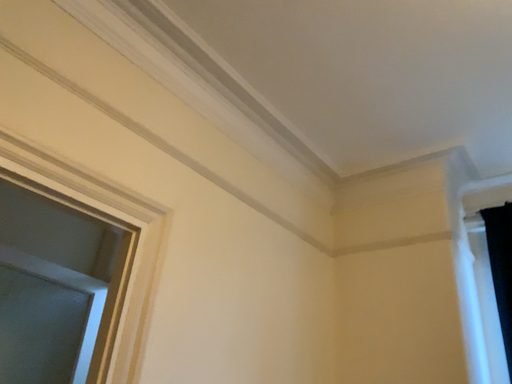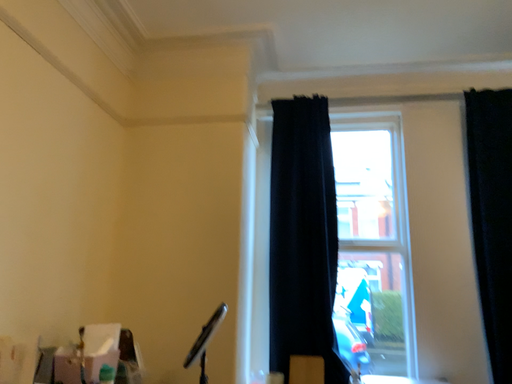
Question: How did the camera likely rotate when shooting the video?

Choices:
 (A) rotated upward
 (B) rotated downward

Answer: (B)